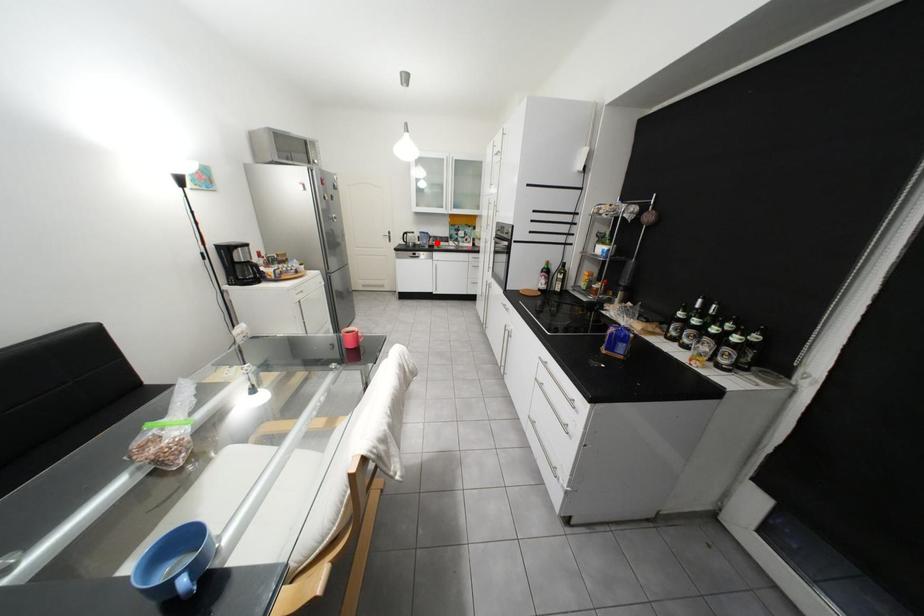
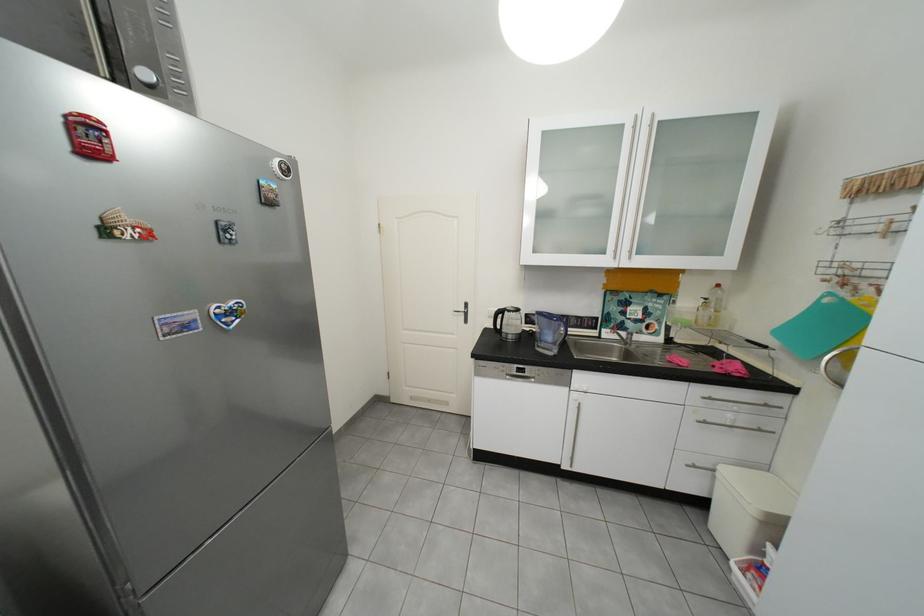
Find the pixel in the second image that matches the highlighted location in the first image.

(561, 339)